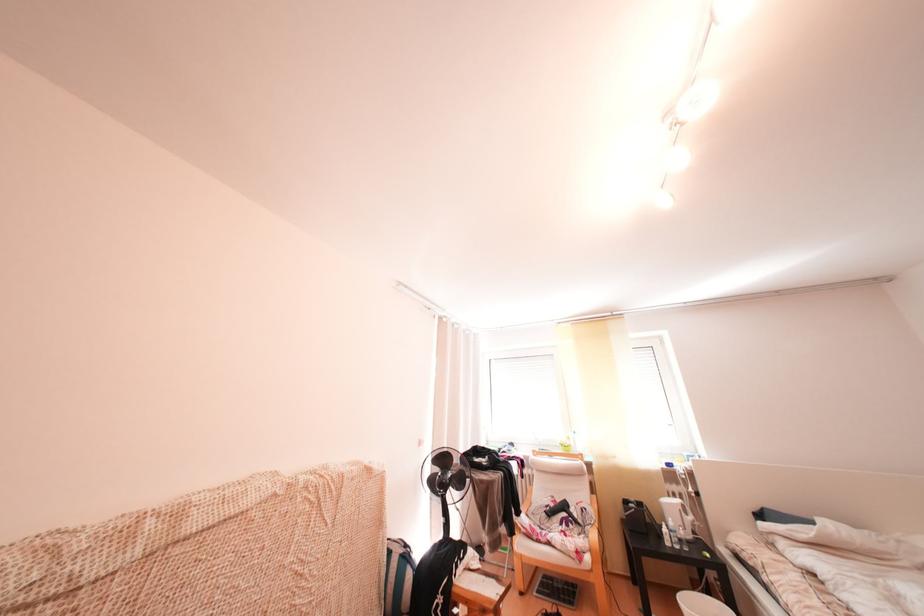
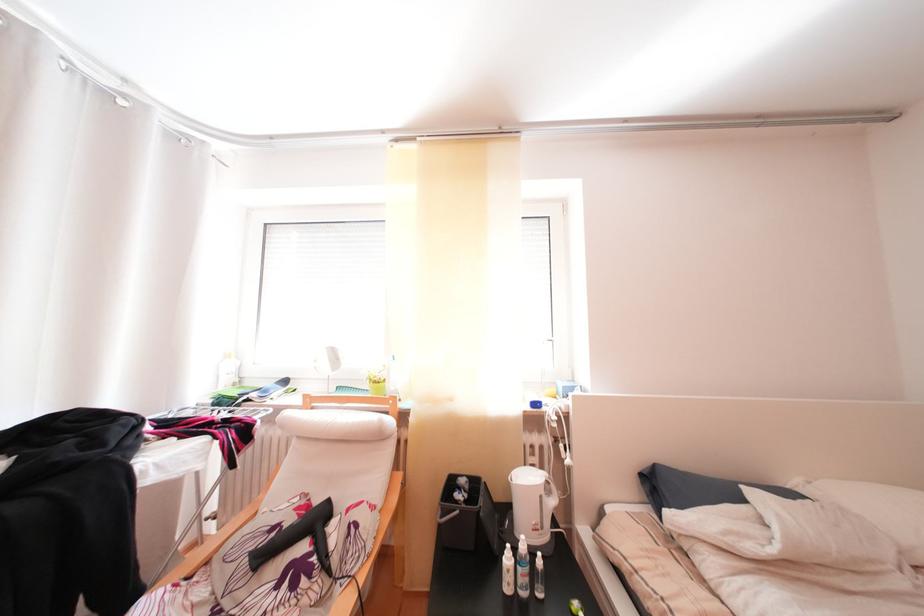
Find the pixel in the second image that matches point 684,529 in the first image.

(536, 553)